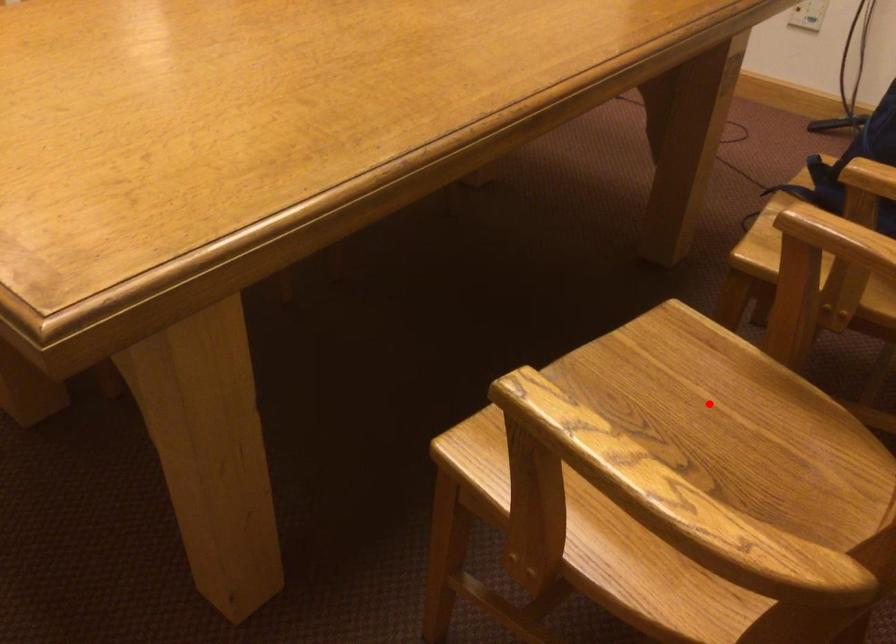
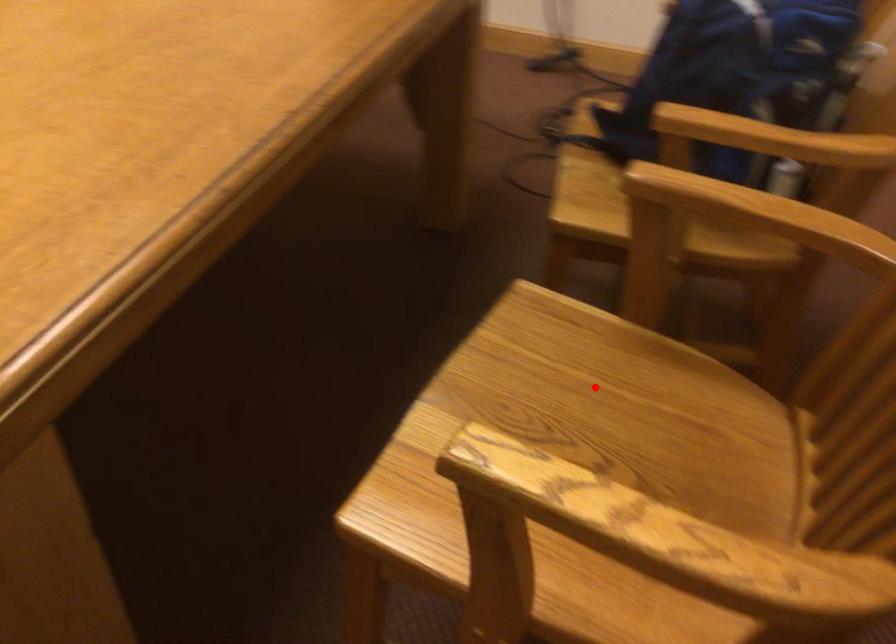
I am providing you with two images of the same scene from different viewpoints. A red point is marked on the first image and another point is marked on the second image. Is the red point in image1 aligned with the point shown in image2?

Yes